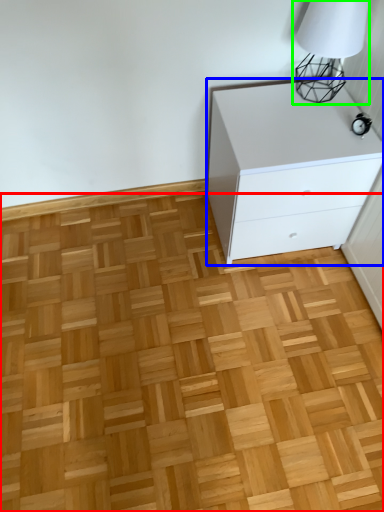
Question: Which object is the closest to the hardwood (highlighted by a red box)? Choose among these: chest of drawers (highlighted by a blue box) or table lamp (highlighted by a green box).

Choices:
 (A) chest of drawers
 (B) table lamp

Answer: (A)